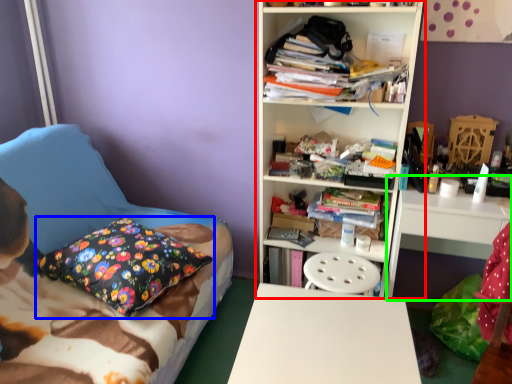
Question: Which is nearer to the bookcase (highlighted by a red box)? pillow (highlighted by a blue box) or computer desk (highlighted by a green box).

Choices:
 (A) pillow
 (B) computer desk

Answer: (B)